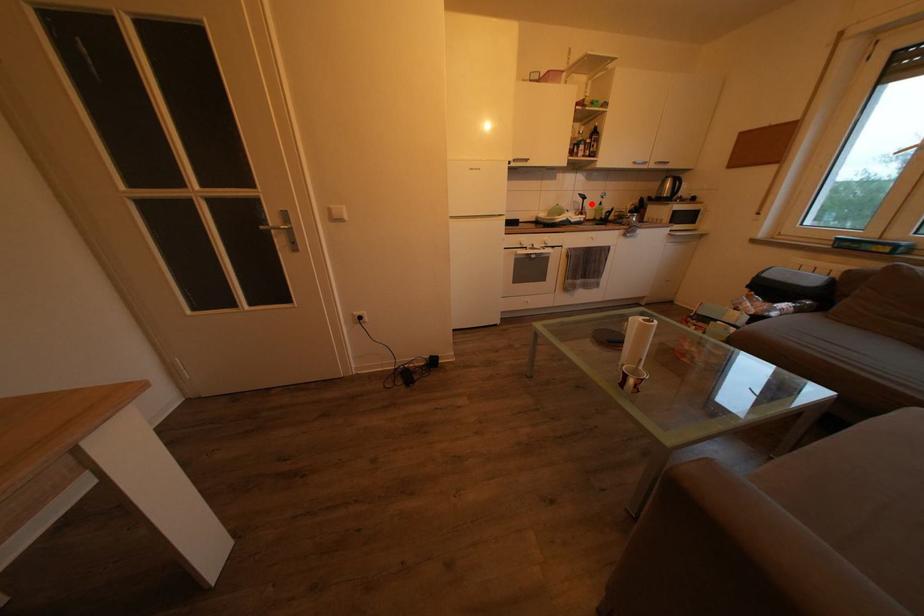
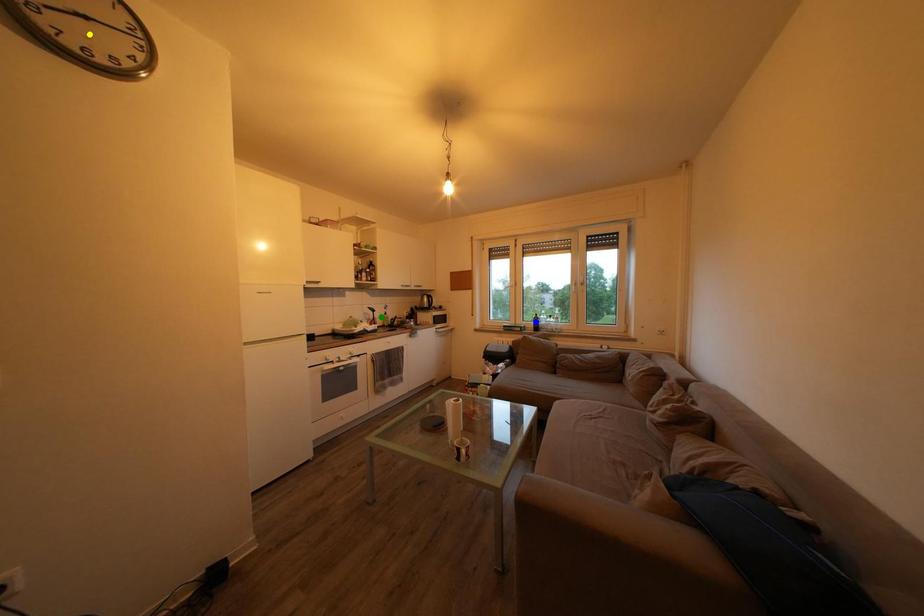
Question: I am providing you with two images of the same scene from different viewpoints. A red point is marked on the first image. You are given multiple points on the second image. Which spot in image 2 lines up with the point in image 1?

Choices:
 (A) blue point
 (B) green point
 (C) yellow point

Answer: (B)